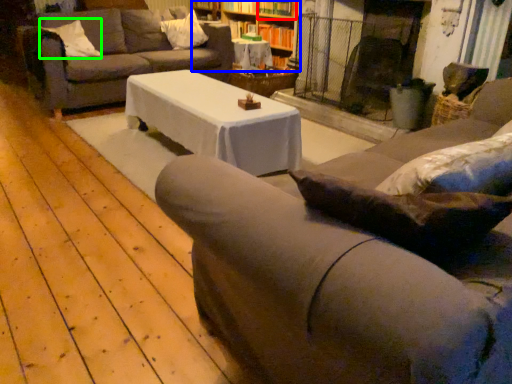
Question: Based on their relative distances, which object is nearer to shelf (highlighted by a red box)? Choose from bookcase (highlighted by a blue box) and pillow (highlighted by a green box).

Choices:
 (A) bookcase
 (B) pillow

Answer: (A)